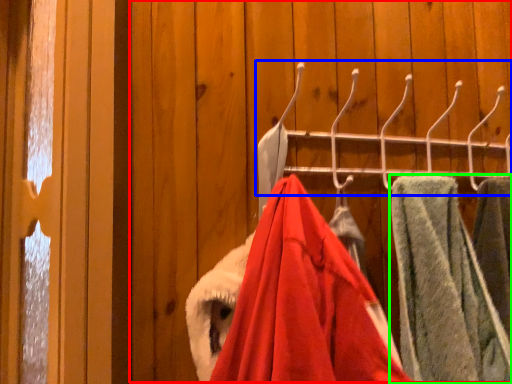
Question: Which is nearer to the closet (highlighted by a red box)? closet (highlighted by a blue box) or towel (highlighted by a green box).

Choices:
 (A) closet
 (B) towel

Answer: (A)